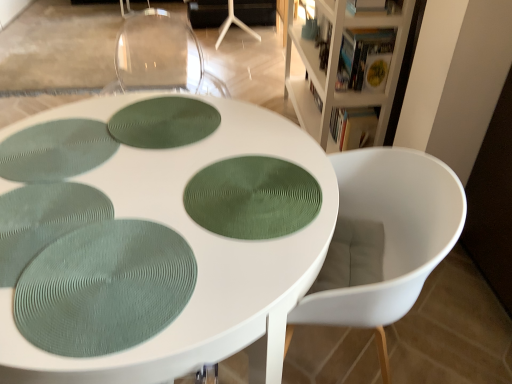
I want to click on vacant space to the right of green textured placemat at center, which ranks as the first oval in top-to-bottom order, so click(257, 149).